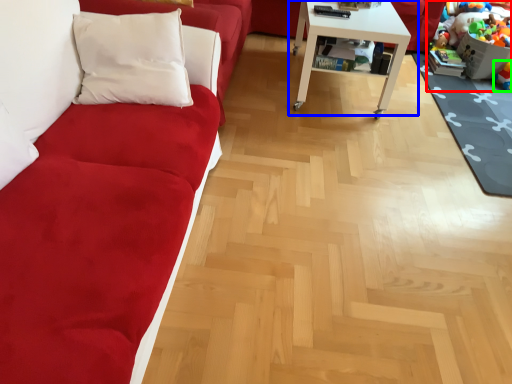
Question: Which object is the closest to the toy (highlighted by a red box)? Choose among these: table (highlighted by a blue box) or toy (highlighted by a green box).

Choices:
 (A) table
 (B) toy

Answer: (B)